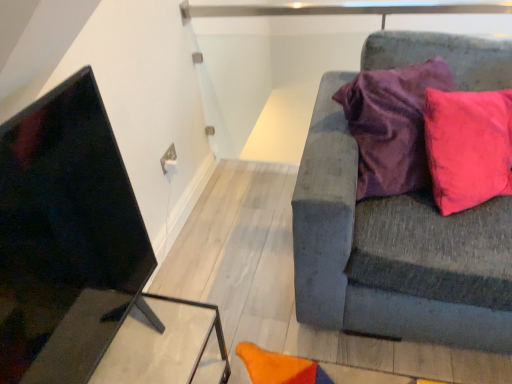
Locate an element on the screen. The width and height of the screenshot is (512, 384). empty space that is ontop of matte black table at lower left (from a real-world perspective) is located at coordinates click(143, 335).